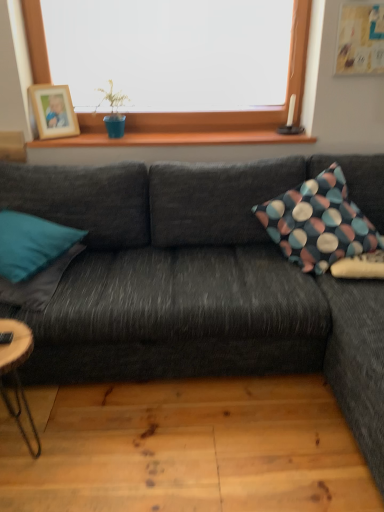
Question: Considering the positions of teal fabric pillow at left, arranged as the 1th pillow when viewed from the left, and wooden at upper center in the image, is teal fabric pillow at left, arranged as the 1th pillow when viewed from the left, taller or shorter than wooden at upper center?

Choices:
 (A) tall
 (B) short

Answer: (A)

Question: Is teal fabric pillow at left, marked as the 3th pillow in a right-to-left arrangement, in front of or behind wooden at upper center in the image?

Choices:
 (A) front
 (B) behind

Answer: (A)

Question: Which is farther from the natural wood plank at lower center?

Choices:
 (A) dark gray fabric couch at center
 (B) wooden natural coffee table at lower left
 (C) teal fabric pillow at left, marked as the 3th pillow in a right-to-left arrangement
 (D) wooden photo frame at upper left
 (E) polka dot fabric pillow at right, placed as the first pillow when sorted from right to left

Answer: (D)

Question: Estimate the real-world distances between objects in this image. Which object is farther from the teal fabric pillow at left, the second pillow viewed from the left?

Choices:
 (A) natural wood plank at lower center
 (B) wooden natural coffee table at lower left
 (C) wooden photo frame at upper left
 (D) teal fabric pillow at left, arranged as the 1th pillow when viewed from the left
 (E) dark gray fabric couch at center

Answer: (C)